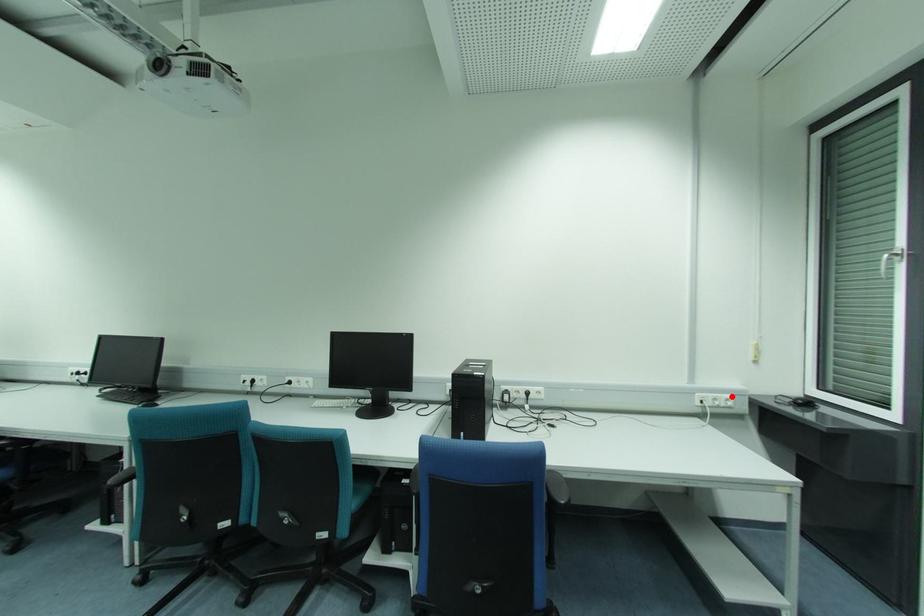
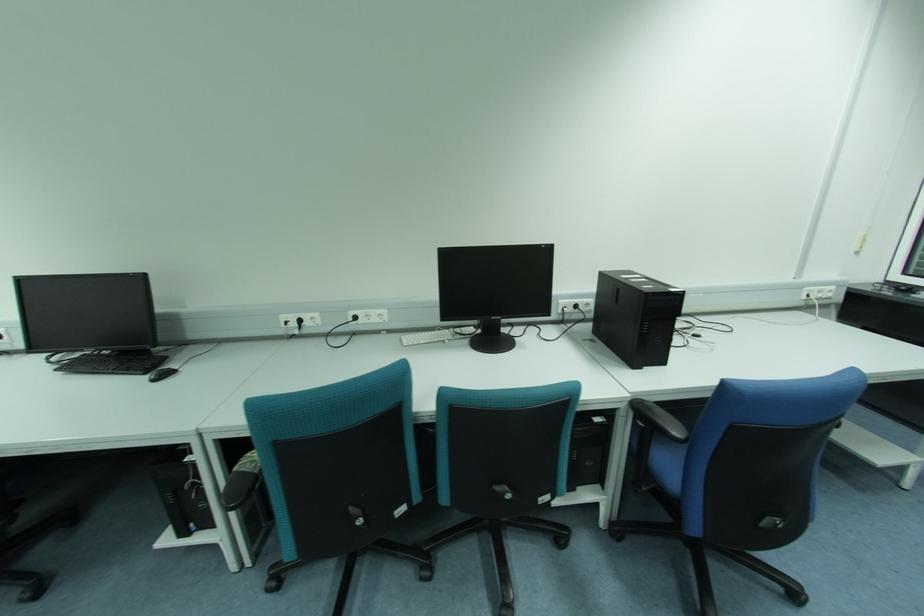
Locate, in the second image, the point that corresponds to the highlighted location in the first image.

(833, 288)